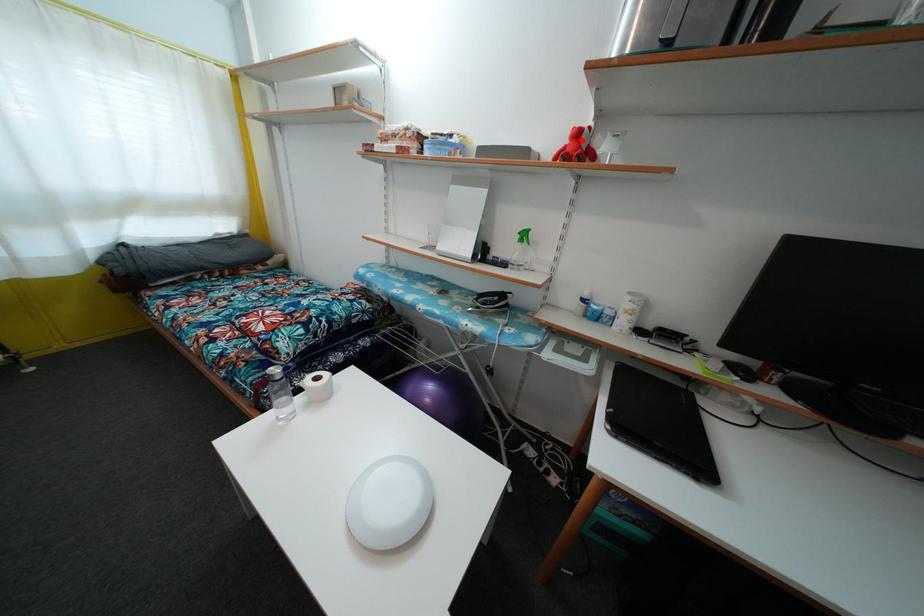
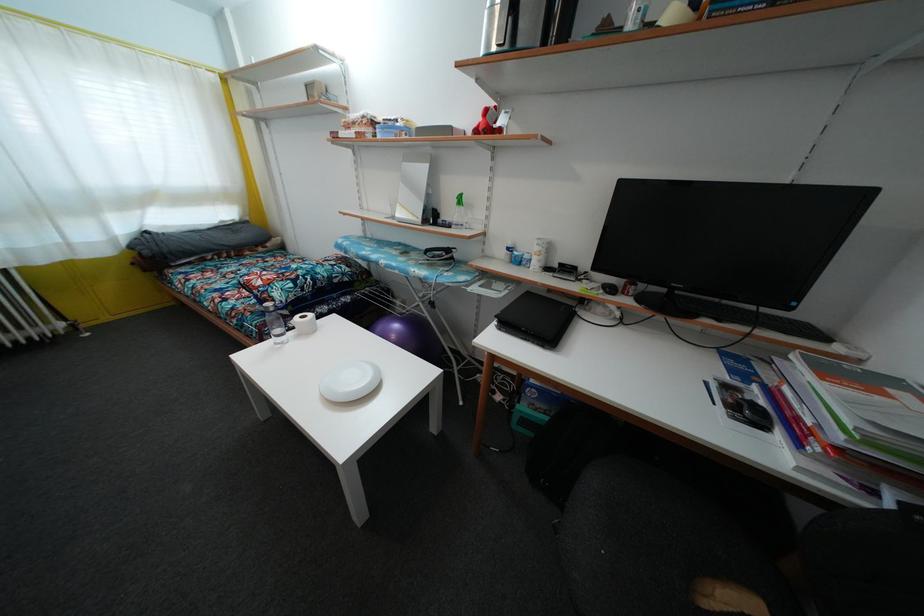
In the second image, find the point that corresponds to the highlighted location in the first image.

(490, 119)